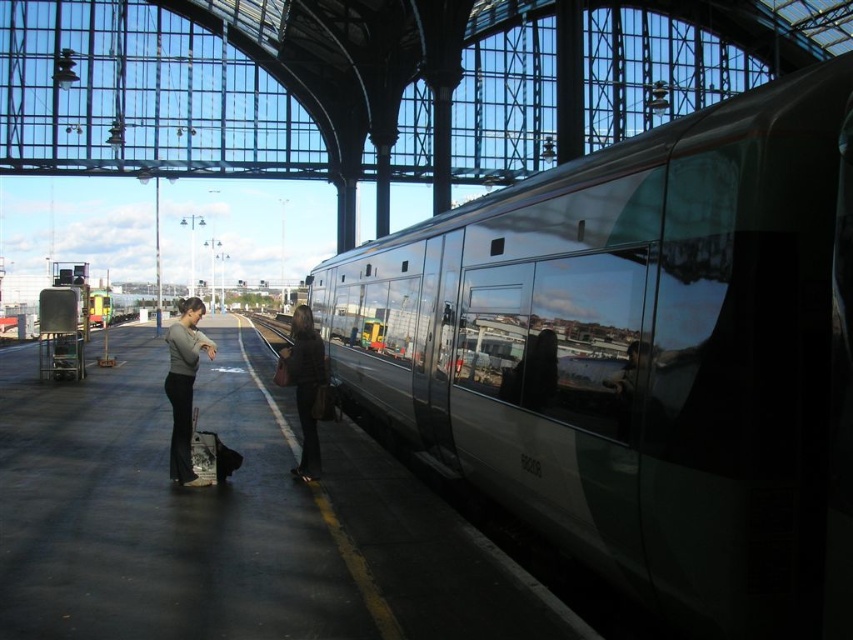
Question: Is smooth concrete platform at center positioned at the back of dark brown leather jacket at center?

Choices:
 (A) yes
 (B) no

Answer: (B)

Question: Can you confirm if shiny metallic train at right is bigger than smooth concrete platform at center?

Choices:
 (A) no
 (B) yes

Answer: (B)

Question: Which object is the farthest from the shiny metallic train at right?

Choices:
 (A) dark brown leather jacket at center
 (B) matte gray sweater at left

Answer: (B)

Question: Considering the relative positions of smooth concrete platform at center and dark brown leather jacket at center in the image provided, where is smooth concrete platform at center located with respect to dark brown leather jacket at center?

Choices:
 (A) below
 (B) above

Answer: (A)

Question: Which point is closer to the camera taking this photo?

Choices:
 (A) (352, 499)
 (B) (283, 376)
 (C) (592, 513)
 (D) (187, 330)

Answer: (C)

Question: Which is farther from the dark brown leather jacket at center?

Choices:
 (A) matte gray sweater at left
 (B) smooth concrete platform at center

Answer: (B)